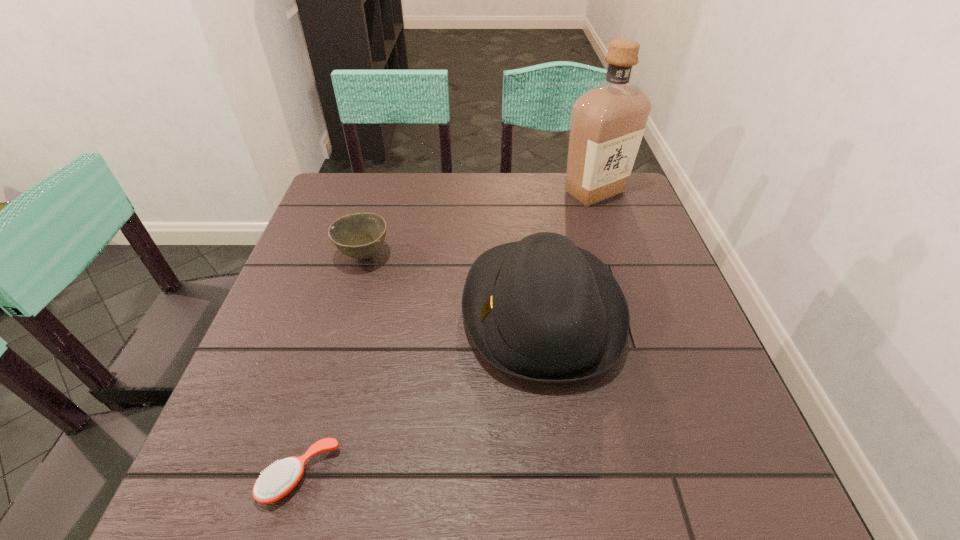
Where is `empty space that is in between the liquor and the bowl`? empty space that is in between the liquor and the bowl is located at coordinates 479,224.

Where is `unoccupied area between the hairbrush and the fedora`? The width and height of the screenshot is (960, 540). unoccupied area between the hairbrush and the fedora is located at coordinates (421, 393).

Identify the location of vacant space in between the hairbrush and the tallest object. (447, 333).

Where is `empty space that is in between the shortest object and the farthest object`? empty space that is in between the shortest object and the farthest object is located at coordinates (447, 333).

Locate an element on the screen. The image size is (960, 540). free space between the second shortest object and the shortest object is located at coordinates (332, 365).

Locate an element on the screen. empty space between the second shortest object and the tallest object is located at coordinates (479, 224).

Select which object is the second closest to the liquor. Please provide its 2D coordinates. Your answer should be formatted as a tuple, i.e. [(x, y)], where the tuple contains the x and y coordinates of a point satisfying the conditions above.

[(360, 235)]

Identify the location of object that ranks as the closest to the third tallest object. This screenshot has width=960, height=540. (541, 309).

The width and height of the screenshot is (960, 540). What are the coordinates of `vacant point that satisfies the following two spatial constraints: 1. on the front-facing side of the farthest object; 2. on the front-facing side of the third shortest object` in the screenshot? It's located at (635, 311).

Locate an element on the screen. The height and width of the screenshot is (540, 960). vacant space that satisfies the following two spatial constraints: 1. on the front-facing side of the tallest object; 2. on the front-facing side of the third shortest object is located at coordinates (635, 311).